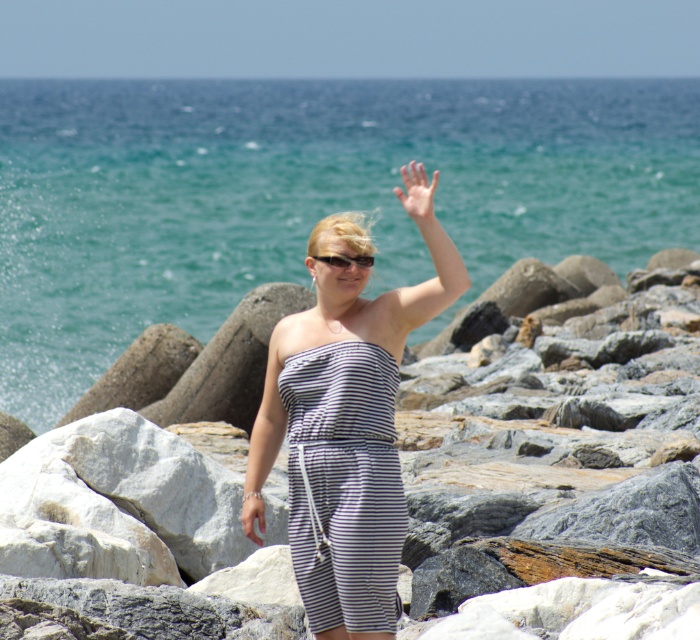
Describe the element at coordinates (304, 196) in the screenshot. I see `blue water at upper center` at that location.

Between blue water at upper center and gray rock at center, which one has more height?

blue water at upper center is taller.

Which is behind, point (294, 170) or point (699, 536)?

Positioned behind is point (294, 170).

I want to click on blue water at upper center, so click(304, 196).

Can you confirm if blue water at upper center is thinner than smooth skin hand at upper center?

In fact, blue water at upper center might be wider than smooth skin hand at upper center.

Which is more to the right, blue water at upper center or smooth skin hand at upper center?

smooth skin hand at upper center

The image size is (700, 640). Identify the location of blue water at upper center. (304, 196).

Is point (402, 538) closer to camera compared to point (368, 260)?

Yes, it is in front of point (368, 260).

Is purple striped dress at center to the right of black plastic sunglasses at center from the viewer's perspective?

Correct, you'll find purple striped dress at center to the right of black plastic sunglasses at center.

Image resolution: width=700 pixels, height=640 pixels. I want to click on purple striped dress at center, so click(x=343, y=484).